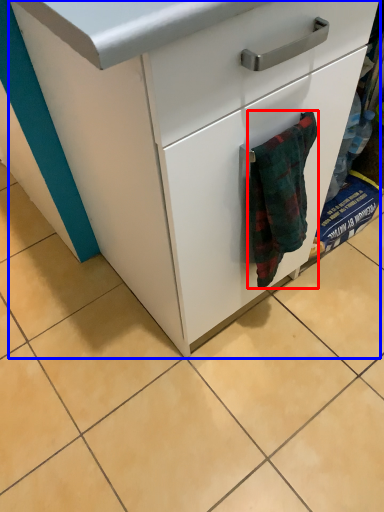
Question: Which of the following is the farthest to the observer, bath towel (highlighted by a red box) or chest of drawers (highlighted by a blue box)?

Choices:
 (A) bath towel
 (B) chest of drawers

Answer: (A)